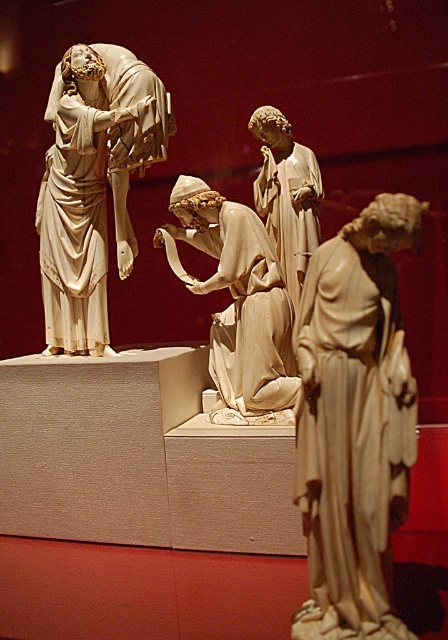
Which is below, matte beige statue at center or white marble statue at left?

matte beige statue at center

The height and width of the screenshot is (640, 448). Describe the element at coordinates (354, 419) in the screenshot. I see `matte beige statue at center` at that location.

Find the location of a particular element. This screenshot has height=640, width=448. matte beige statue at center is located at coordinates (354, 419).

Image resolution: width=448 pixels, height=640 pixels. What do you see at coordinates (93, 186) in the screenshot?
I see `white marble statue at left` at bounding box center [93, 186].

Between white marble statue at left and matte white statue at center, which one is positioned lower?

white marble statue at left

Where is `white marble statue at left`? white marble statue at left is located at coordinates (93, 186).

Is matte beige statue at center above smooth beige statue at center?

Actually, matte beige statue at center is below smooth beige statue at center.

How distant is matte beige statue at center from smooth beige statue at center?

A distance of 32.92 inches exists between matte beige statue at center and smooth beige statue at center.

Is point (375, 438) positioned after point (272, 400)?

No, (375, 438) is closer to viewer.

The image size is (448, 640). I want to click on matte beige statue at center, so click(x=354, y=419).